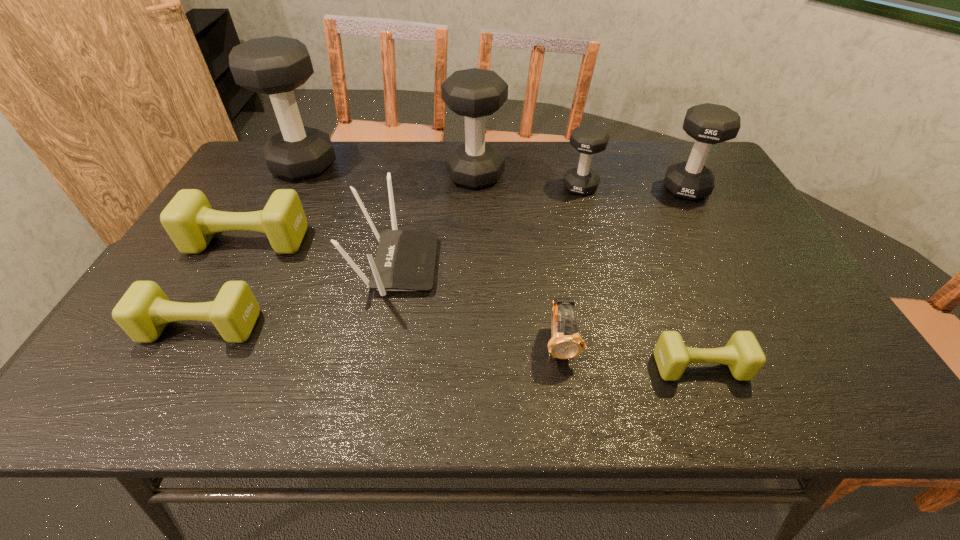
This screenshot has width=960, height=540. What are the coordinates of `vacant area located on the right of the fourth tallest dumbbell` in the screenshot? It's located at (697, 187).

Locate an element on the screen. This screenshot has width=960, height=540. vacant space located on the front-facing side of the router is located at coordinates (492, 265).

At what (x,y) coordinates should I click in order to perform the action: click on vacant space located on the front of the farthest olive dumbbell. Please return your answer as a coordinate pair (x, y). This screenshot has width=960, height=540. Looking at the image, I should click on (173, 377).

Find the location of a particular element. This screenshot has height=540, width=960. free point located on the face of the sixth object from left to right is located at coordinates (568, 394).

At what (x,y) coordinates should I click in order to perform the action: click on vacant space situated 0.360m on the back of the sixth tallest dumbbell. Please return your answer as a coordinate pair (x, y). Looking at the image, I should click on (265, 212).

You are a GUI agent. You are given a task and a screenshot of the screen. Output one action in this format:
    pyautogui.click(x=<x>, y=<y>)
    Task: Click on the free region located on the back of the nearest dumbbell
    The image size is (960, 540).
    Given the screenshot: What is the action you would take?
    pyautogui.click(x=652, y=246)

The width and height of the screenshot is (960, 540). What are the coordinates of `object at the near edge` in the screenshot? It's located at (743, 355).

Locate an element on the screen. This screenshot has width=960, height=540. object that is at the right edge is located at coordinates tap(708, 124).

Where is `object located at the far left corner`? object located at the far left corner is located at coordinates (276, 65).

Where is `object positioned at the far right corner`? This screenshot has width=960, height=540. object positioned at the far right corner is located at coordinates (708, 124).